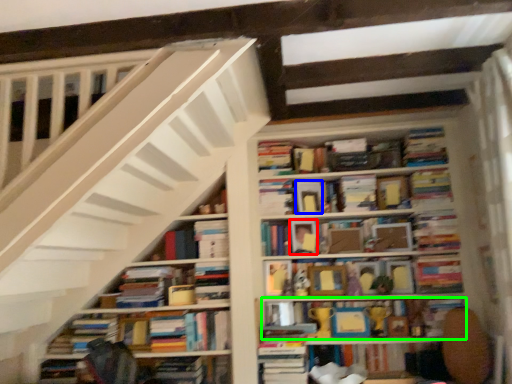
Question: Considering the real-world distances, which object is closest to paperback book (highlighted by a red box)? paperback book (highlighted by a blue box) or book (highlighted by a green box).

Choices:
 (A) paperback book
 (B) book

Answer: (A)